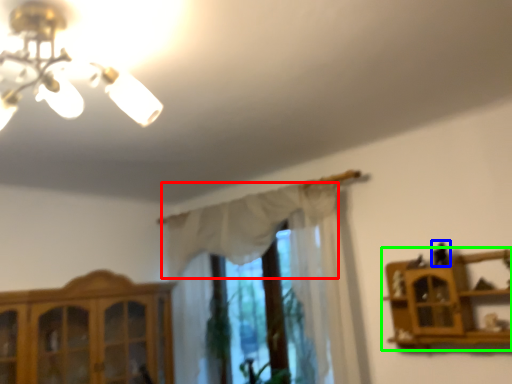
Question: Which is farther away from curtain (highlighted by a red box)? toy (highlighted by a blue box) or shelf (highlighted by a green box)?

Choices:
 (A) toy
 (B) shelf

Answer: (A)